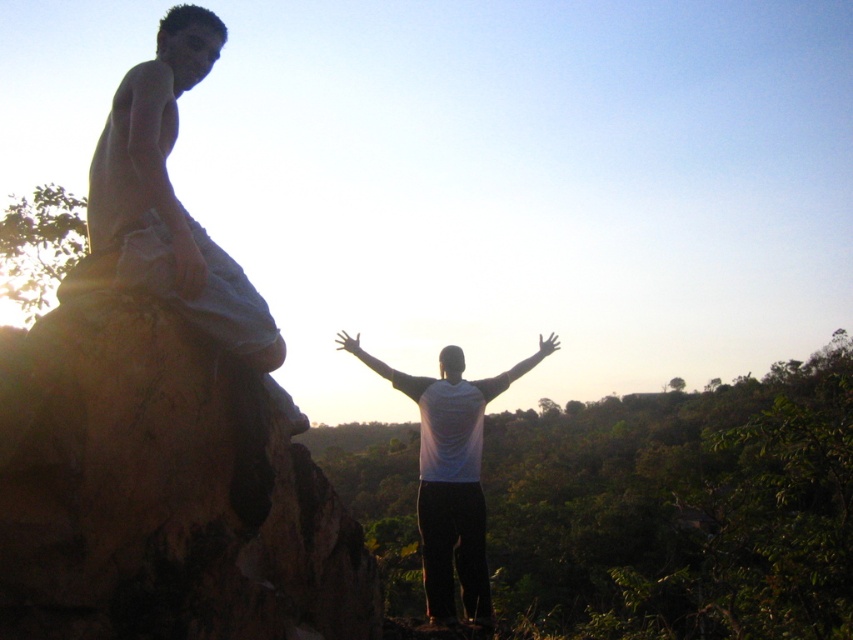
Question: Considering the relative positions of white matte shirt at center and transparent plastic hand at center in the image provided, where is white matte shirt at center located with respect to transparent plastic hand at center?

Choices:
 (A) right
 (B) left

Answer: (B)

Question: Which point is farther from the camera taking this photo?

Choices:
 (A) (189, 8)
 (B) (175, 266)
 (C) (361, 352)
 (D) (546, 340)

Answer: (D)

Question: Which object is the farthest from the matte gray shorts at upper left?

Choices:
 (A) transparent plastic hand at center
 (B) white matte hand at center

Answer: (A)

Question: Which of the following is the closest to the observer?

Choices:
 (A) (358, 346)
 (B) (428, 449)
 (C) (154, 129)

Answer: (C)

Question: In this image, where is white matte hand at center located relative to transparent plastic hand at center?

Choices:
 (A) below
 (B) above

Answer: (A)

Question: Can you confirm if matte white hand at upper left is positioned above transparent plastic hand at center?

Choices:
 (A) yes
 (B) no

Answer: (A)